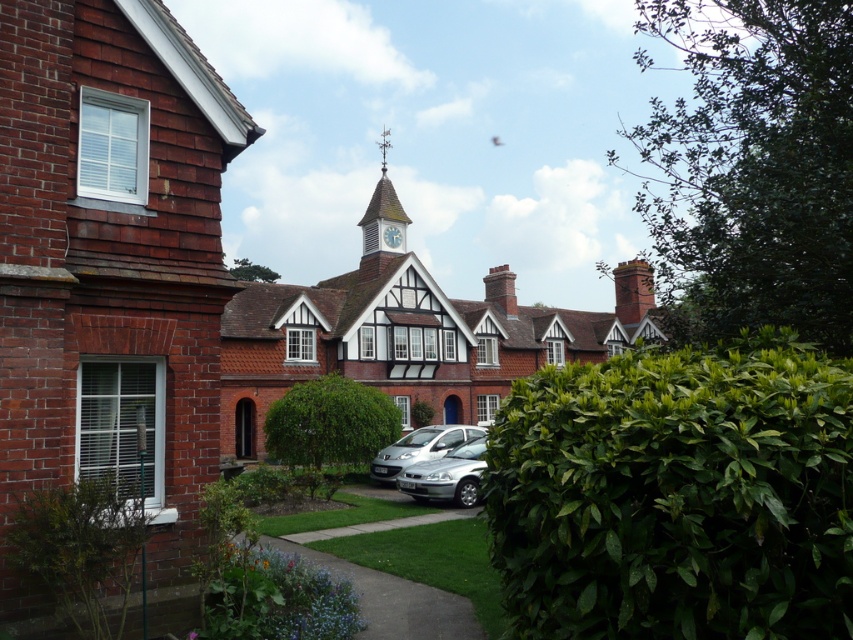
Question: Among these objects, which one is nearest to the camera?

Choices:
 (A) green leafy hedge at lower left
 (B) red brick church at center
 (C) green leafy hedge at lower right

Answer: (C)

Question: Among these points, which one is nearest to the camera?

Choices:
 (A) (44, 561)
 (B) (467, 625)
 (C) (410, 321)

Answer: (A)

Question: Does brick house at left appear over green leafy hedge at center?

Choices:
 (A) no
 (B) yes

Answer: (B)

Question: Does brick house at left have a greater width compared to red brick church at center?

Choices:
 (A) yes
 (B) no

Answer: (B)

Question: Which object appears farthest from the camera in this image?

Choices:
 (A) brick house at left
 (B) silver metallic car at center

Answer: (B)

Question: Does green leafy hedge at lower left have a greater width compared to satin silver car at center?

Choices:
 (A) no
 (B) yes

Answer: (A)